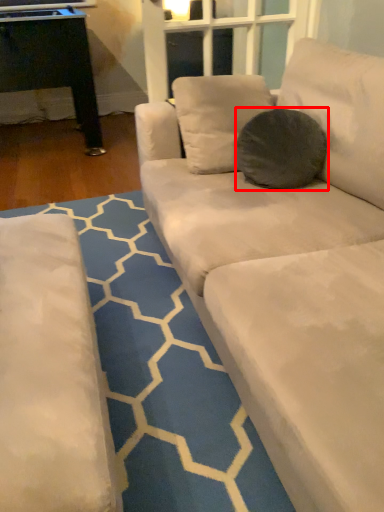
Question: From the image, what is the correct spatial relationship of throw pillow (annotated by the red box) in relation to pattern?

Choices:
 (A) left
 (B) right

Answer: (B)